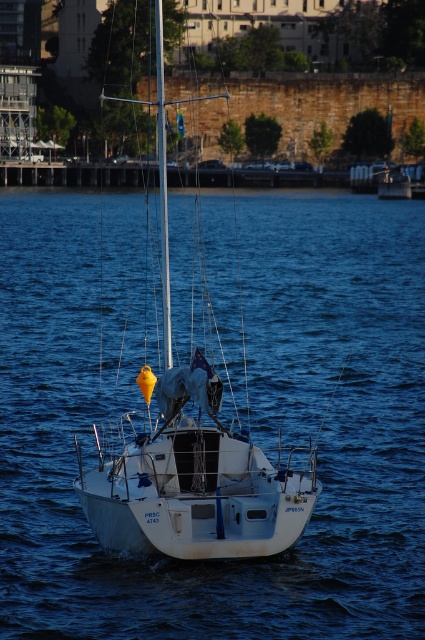
Question: Which of the following is the farthest from the observer?

Choices:
 (A) white matte water at center
 (B) white matte sailboat at center

Answer: (B)

Question: Observing the image, what is the correct spatial positioning of white matte water at center in reference to white matte sailboat at center?

Choices:
 (A) left
 (B) right

Answer: (B)

Question: Is white matte water at center wider than white matte sailboat at center?

Choices:
 (A) yes
 (B) no

Answer: (A)

Question: Which of the following is the closest to the observer?

Choices:
 (A) (272, 600)
 (B) (170, 499)

Answer: (A)

Question: Can you confirm if white matte water at center is smaller than white matte sailboat at center?

Choices:
 (A) yes
 (B) no

Answer: (B)

Question: Which object appears farthest from the camera in this image?

Choices:
 (A) white matte water at center
 (B) white matte sailboat at center

Answer: (B)